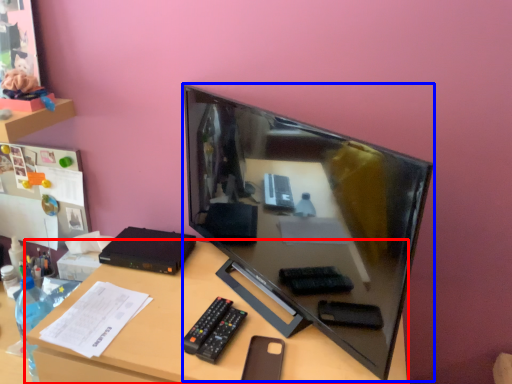
Question: Which object appears closest to the camera in this image, desk (highlighted by a red box) or television (highlighted by a blue box)?

Choices:
 (A) desk
 (B) television

Answer: (B)